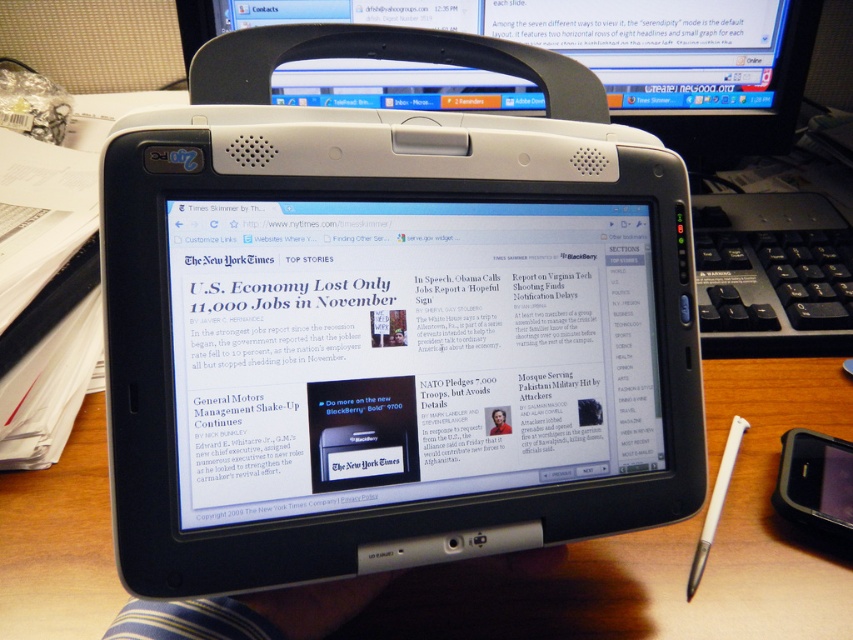
Question: Which of these objects is positioned closest to the wooden table at center?

Choices:
 (A) white plastic laptop at center
 (B) black plastic computer monitor at upper center

Answer: (A)

Question: Can you confirm if wooden table at center is positioned below black plastic computer monitor at upper center?

Choices:
 (A) yes
 (B) no

Answer: (A)

Question: Which point is farther from the camera taking this photo?

Choices:
 (A) (778, 141)
 (B) (13, 493)
 (C) (757, 92)

Answer: (A)

Question: Is white plastic laptop at center to the right of white plastic stylus at lower right from the viewer's perspective?

Choices:
 (A) yes
 (B) no

Answer: (B)

Question: Which point is closer to the camera taking this photo?

Choices:
 (A) (654, 572)
 (B) (323, 61)

Answer: (A)

Question: Can you confirm if black plastic computer monitor at upper center is positioned above white plastic stylus at lower right?

Choices:
 (A) no
 (B) yes

Answer: (B)